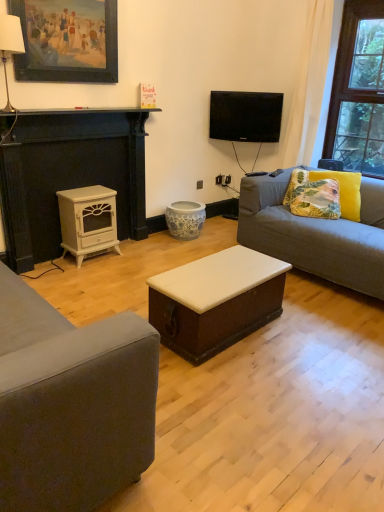
The image size is (384, 512). I want to click on vacant area in front of white painted wood fireplace at left, so click(x=88, y=282).